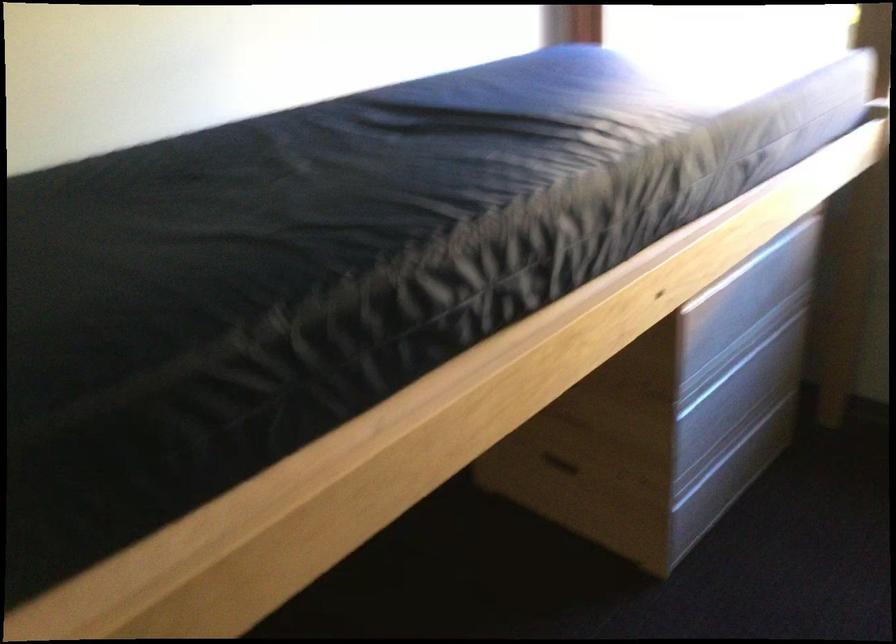
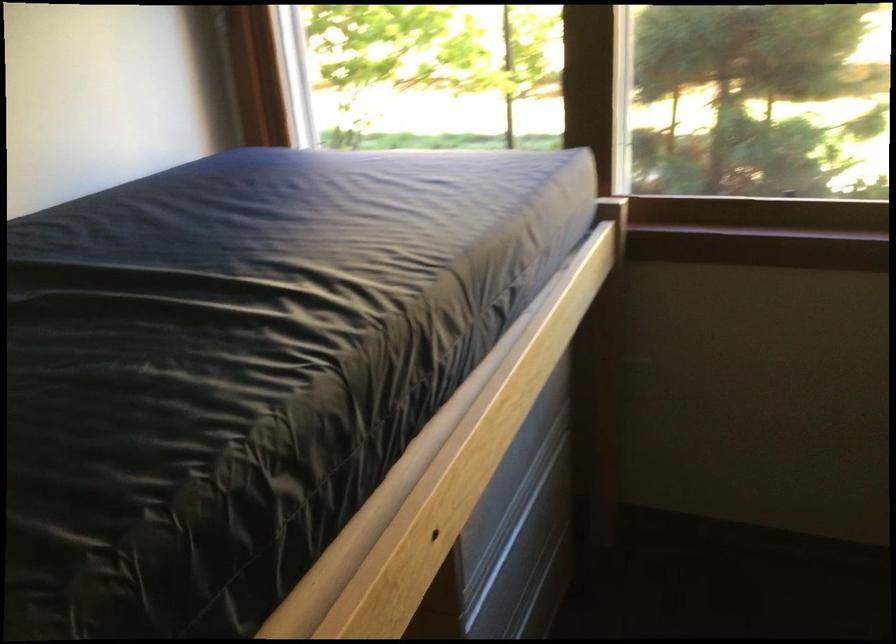
The point at (685, 270) is marked in the first image. Where is the corresponding point in the second image?

(467, 478)